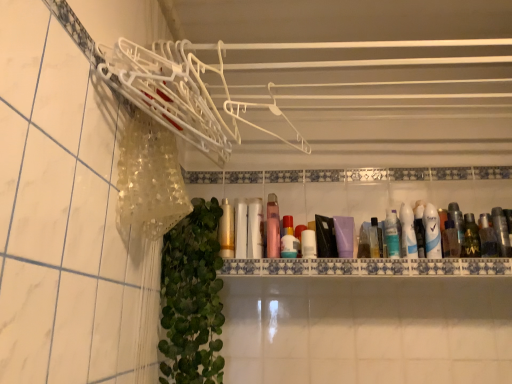
At what (x,y) coordinates should I click in order to perform the action: click on translucent plastic mouthwash at right, arranged as the 4th mouthwash when viewed from the right. Please return your answer as a coordinate pair (x, y). Looking at the image, I should click on (457, 224).

Describe the element at coordinates (289, 239) in the screenshot. I see `translucent plastic bottle at center, which ranks as the fifth mouthwash in left-to-right order` at that location.

Consider the image. Measure the distance between point (x=284, y=245) and camera.

A distance of 4.70 feet exists between point (x=284, y=245) and camera.

In order to face white matte tube at center, which is the second mouthwash in left-to-right order, should I rotate leftwards or rightwards?

Rotate your view left by about 1.795°.

Describe the element at coordinates (487, 237) in the screenshot. This screenshot has height=384, width=512. I see `translucent plastic mouthwash at right, which is counted as the 11th mouthwash, starting from the left` at that location.

The height and width of the screenshot is (384, 512). I want to click on green matte bottle at right, which is the third mouthwash in right-to-left order, so click(x=471, y=237).

Measure the distance from clear plastic bottle at right, acting as the second mouthwash starting from the right, to translucent plastic mouthwash at right, arranged as the eighth mouthwash when viewed from the left.

The distance of clear plastic bottle at right, acting as the second mouthwash starting from the right, from translucent plastic mouthwash at right, arranged as the eighth mouthwash when viewed from the left, is 5.27 inches.

From the image's perspective, is clear plastic bottle at right, which is the 10th mouthwash from left to right, beneath translucent plastic mouthwash at right, arranged as the eighth mouthwash when viewed from the left?

No, from the image's perspective, clear plastic bottle at right, which is the 10th mouthwash from left to right, is not beneath translucent plastic mouthwash at right, arranged as the eighth mouthwash when viewed from the left.

Is clear plastic bottle at right, acting as the second mouthwash starting from the right, not within translucent plastic mouthwash at right, arranged as the 4th mouthwash when viewed from the right?

Yes, clear plastic bottle at right, acting as the second mouthwash starting from the right, is not within translucent plastic mouthwash at right, arranged as the 4th mouthwash when viewed from the right.

From their relative heights in the image, would you say clear plastic bottle at right, which is the 10th mouthwash from left to right, is taller or shorter than translucent plastic mouthwash at right, arranged as the 4th mouthwash when viewed from the right?

Clearly, clear plastic bottle at right, which is the 10th mouthwash from left to right, is shorter compared to translucent plastic mouthwash at right, arranged as the 4th mouthwash when viewed from the right.

Does blue glossy deodorant at right, acting as the second toiletry starting from the left, have a larger size compared to gold metallic mouthwash at center, marked as the 11th mouthwash in a right-to-left arrangement?

No.

Considering the points (405, 239) and (220, 240), which point is in front, point (405, 239) or point (220, 240)?

The point (405, 239) is closer to the camera.

Is blue glossy deodorant at right, the first toiletry viewed from the right, wider than gold metallic mouthwash at center, the first mouthwash when ordered from left to right?

Incorrect, the width of blue glossy deodorant at right, the first toiletry viewed from the right, does not surpass that of gold metallic mouthwash at center, the first mouthwash when ordered from left to right.

Is the surface of translucent plastic bottle at center, which ranks as the fifth mouthwash in left-to-right order, in direct contact with blue glossy mouthwash at right, placed as the sixth mouthwash when sorted from left to right?

No, translucent plastic bottle at center, which ranks as the fifth mouthwash in left-to-right order, is not in contact with blue glossy mouthwash at right, placed as the sixth mouthwash when sorted from left to right.

The width and height of the screenshot is (512, 384). There is a translucent plastic bottle at center, which ranks as the fifth mouthwash in left-to-right order. Find the location of `the 3rd mouthwash above it (from the image's perspective)`. the 3rd mouthwash above it (from the image's perspective) is located at coordinates (392, 234).

From a real-world perspective, who is located higher, translucent plastic bottle at center, the seventh mouthwash viewed from the right, or blue glossy mouthwash at right, which ranks as the sixth mouthwash in right-to-left order?

In real-world perspective, blue glossy mouthwash at right, which ranks as the sixth mouthwash in right-to-left order, is above.

From the image's perspective, between translucent plastic bottle at center, the seventh mouthwash viewed from the right, and blue glossy mouthwash at right, placed as the sixth mouthwash when sorted from left to right, which one is located above?

blue glossy mouthwash at right, placed as the sixth mouthwash when sorted from left to right, is shown above in the image.

Does translucent plastic mouthwash at right, which is counted as the 11th mouthwash, starting from the left, come behind white glossy tube at center, which is the first toiletry in left-to-right order?

That is True.

Which of these two, translucent plastic mouthwash at right, which is counted as the first mouthwash, starting from the right, or white glossy tube at center, the second toiletry from the right, stands shorter?

white glossy tube at center, the second toiletry from the right, is shorter.

Could you tell me if translucent plastic mouthwash at right, which is counted as the first mouthwash, starting from the right, is turned towards white glossy tube at center, which is the first toiletry in left-to-right order?

No, translucent plastic mouthwash at right, which is counted as the first mouthwash, starting from the right, is not oriented towards white glossy tube at center, which is the first toiletry in left-to-right order.

Does point (482, 220) appear closer or farther from the camera than point (312, 246)?

Point (482, 220).

Considering the sizes of objects pink glossy bottle at center, the 4th mouthwash in the left-to-right sequence, and white matte tube at center, the third mouthwash when ordered from left to right, in the image provided, who is smaller, pink glossy bottle at center, the 4th mouthwash in the left-to-right sequence, or white matte tube at center, the third mouthwash when ordered from left to right,?

Smaller between the two is white matte tube at center, the third mouthwash when ordered from left to right.

Is pink glossy bottle at center, the 4th mouthwash in the left-to-right sequence, touching white matte tube at center, the third mouthwash when ordered from left to right?

Yes, pink glossy bottle at center, the 4th mouthwash in the left-to-right sequence, is in contact with white matte tube at center, the third mouthwash when ordered from left to right.

Which of these two, pink glossy bottle at center, the 4th mouthwash in the left-to-right sequence, or white matte tube at center, the third mouthwash when ordered from left to right, stands taller?

pink glossy bottle at center, the 4th mouthwash in the left-to-right sequence.

Is pink glossy bottle at center, which is the 8th mouthwash in right-to-left order, completely or partially outside of green matte bottle at right, which is the third mouthwash in right-to-left order?

Yes, pink glossy bottle at center, which is the 8th mouthwash in right-to-left order, is not within green matte bottle at right, which is the third mouthwash in right-to-left order.

Between pink glossy bottle at center, the 4th mouthwash in the left-to-right sequence, and green matte bottle at right, which is the third mouthwash in right-to-left order, which one is positioned in front?

pink glossy bottle at center, the 4th mouthwash in the left-to-right sequence.

Could you tell me if pink glossy bottle at center, which is the 8th mouthwash in right-to-left order, is facing green matte bottle at right, which is the 9th mouthwash in left-to-right order?

No, pink glossy bottle at center, which is the 8th mouthwash in right-to-left order, is not turned towards green matte bottle at right, which is the 9th mouthwash in left-to-right order.

How much distance is there between clear plastic bottle at right, acting as the second mouthwash starting from the right, and blue glossy mouthwash at right, placed as the sixth mouthwash when sorted from left to right?

The distance of clear plastic bottle at right, acting as the second mouthwash starting from the right, from blue glossy mouthwash at right, placed as the sixth mouthwash when sorted from left to right, is 35.65 centimeters.

Which of these two, clear plastic bottle at right, acting as the second mouthwash starting from the right, or blue glossy mouthwash at right, which ranks as the sixth mouthwash in right-to-left order, is smaller?

With smaller size is clear plastic bottle at right, acting as the second mouthwash starting from the right.

From the image's perspective, which mouthwash is the 6th one below the clear plastic bottle at right, which is the 10th mouthwash from left to right? Please provide its 2D coordinates.

[(392, 234)]

Is clear plastic bottle at right, acting as the second mouthwash starting from the right, positioned beyond the bounds of blue glossy mouthwash at right, which ranks as the sixth mouthwash in right-to-left order?

Yes, clear plastic bottle at right, acting as the second mouthwash starting from the right, is outside of blue glossy mouthwash at right, which ranks as the sixth mouthwash in right-to-left order.

From the image's perspective, count 4th mouthwashs upward from the translucent plastic mouthwash at right, arranged as the 4th mouthwash when viewed from the right, and point to it. Please provide its 2D coordinates.

[(501, 231)]

Where is `toiletry located above the gold metallic mouthwash at center, the first mouthwash when ordered from left to right (from a real-world perspective)`? toiletry located above the gold metallic mouthwash at center, the first mouthwash when ordered from left to right (from a real-world perspective) is located at coordinates 408,232.

Considering their positions, is green matte bottle at right, which is the 9th mouthwash in left-to-right order, positioned closer to pink glossy bottle at center, the 4th mouthwash in the left-to-right sequence, than white glossy tube at right, which is counted as the 7th mouthwash, starting from the left?

Among the two, white glossy tube at right, which is counted as the 7th mouthwash, starting from the left, is located nearer to pink glossy bottle at center, the 4th mouthwash in the left-to-right sequence.

From the image, which object appears to be farther from white glossy tube at center, the second toiletry from the right, white matte shaving cream at right or green matte bottle at right, which is the 9th mouthwash in left-to-right order?

green matte bottle at right, which is the 9th mouthwash in left-to-right order, lies further to white glossy tube at center, the second toiletry from the right, than the other object.

From the image, which object appears to be farther from pink glossy bottle at center, which is the 8th mouthwash in right-to-left order, white glossy tube at right, which is the 5th mouthwash in right-to-left order, or blue glossy deodorant at right, the first toiletry viewed from the right?

white glossy tube at right, which is the 5th mouthwash in right-to-left order, lies further to pink glossy bottle at center, which is the 8th mouthwash in right-to-left order, than the other object.

Estimate the real-world distances between objects in this image. Which object is closer to white glossy tube at right, which is the 5th mouthwash in right-to-left order, green matte bottle at right, which is the third mouthwash in right-to-left order, or white glossy tube at center, the second toiletry from the right?

green matte bottle at right, which is the third mouthwash in right-to-left order.

From the image, which object appears to be nearer to white glossy tube at right, which is the 5th mouthwash in right-to-left order, white matte shaving cream at right or translucent plastic mouthwash at right, arranged as the eighth mouthwash when viewed from the left?

The object closer to white glossy tube at right, which is the 5th mouthwash in right-to-left order, is white matte shaving cream at right.

Based on their spatial positions, is green matte bottle at right, which is the 9th mouthwash in left-to-right order, or white glossy tube at center, the second toiletry from the right, further from gold metallic mouthwash at center, the first mouthwash when ordered from left to right?

Based on the image, green matte bottle at right, which is the 9th mouthwash in left-to-right order, appears to be further to gold metallic mouthwash at center, the first mouthwash when ordered from left to right.

When comparing their distances from white matte shaving cream at right, does white glossy tube at center, which is the first toiletry in left-to-right order, or pink glossy bottle at center, which is the 8th mouthwash in right-to-left order, seem further?

pink glossy bottle at center, which is the 8th mouthwash in right-to-left order, lies further to white matte shaving cream at right than the other object.

In the scene shown: Estimate the real-world distances between objects in this image. Which object is closer to translucent plastic bottles at center, gold metallic mouthwash at center, marked as the 11th mouthwash in a right-to-left arrangement, or clear plastic bottle at right, which is the 10th mouthwash from left to right?

gold metallic mouthwash at center, marked as the 11th mouthwash in a right-to-left arrangement, is positioned closer to the anchor translucent plastic bottles at center.

Find the location of `shaving cream between green leafy plant at lower left and translucent plastic mouthwash at right, which is counted as the first mouthwash, starting from the right, from left to right`. shaving cream between green leafy plant at lower left and translucent plastic mouthwash at right, which is counted as the first mouthwash, starting from the right, from left to right is located at coordinates (432, 232).

Find the location of a particular element. ledge located between pink glossy bottle at center, which is the 8th mouthwash in right-to-left order, and translucent plastic mouthwash at right, arranged as the eighth mouthwash when viewed from the left, in the left-right direction is located at coordinates (368, 266).

Where is `shaving cream between blue glossy mouthwash at right, which ranks as the sixth mouthwash in right-to-left order, and translucent plastic mouthwash at right, arranged as the eighth mouthwash when viewed from the left, from left to right`? shaving cream between blue glossy mouthwash at right, which ranks as the sixth mouthwash in right-to-left order, and translucent plastic mouthwash at right, arranged as the eighth mouthwash when viewed from the left, from left to right is located at coordinates (432, 232).

Locate an element on the screen. The image size is (512, 384). ledge between white glossy tube at center, the second toiletry from the right, and white matte shaving cream at right, in the horizontal direction is located at coordinates (368, 266).